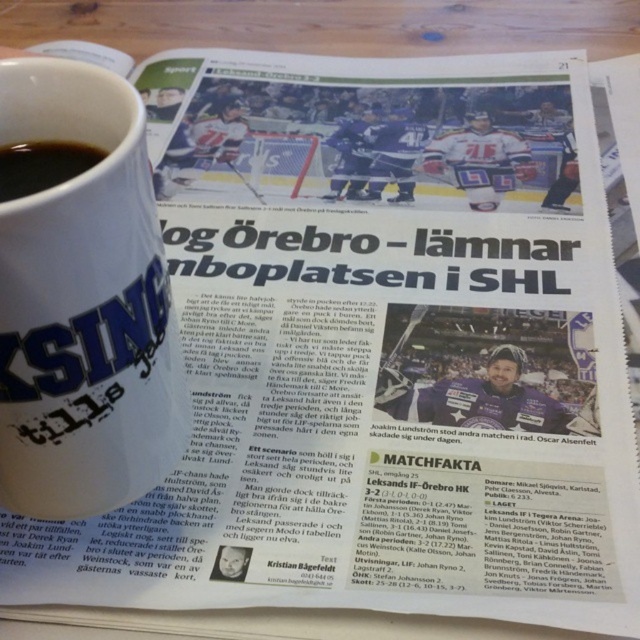
Does point (58, 513) come closer to viewer compared to point (40, 172)?

No.

From the picture: Can you confirm if white matte mug at upper left is positioned above black matte cup at upper left?

No, white matte mug at upper left is not above black matte cup at upper left.

Between point (138, 474) and point (45, 168), which one is positioned behind?

The point (138, 474) is behind.

At what (x,y) coordinates should I click in order to perform the action: click on white matte mug at upper left. Please return your answer as a coordinate pair (x, y). This screenshot has height=640, width=640. Looking at the image, I should click on (81, 298).